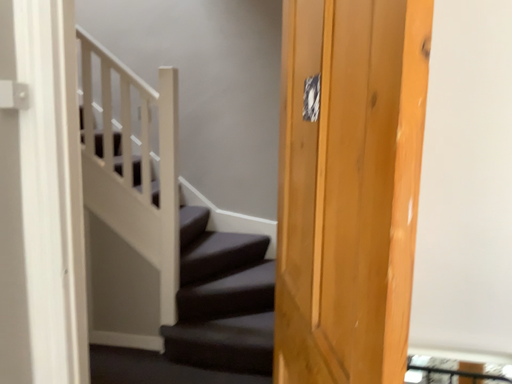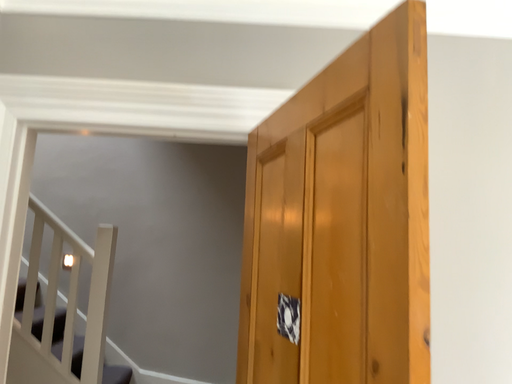
Question: Which way did the camera rotate in the video?

Choices:
 (A) rotated right
 (B) rotated left

Answer: (A)